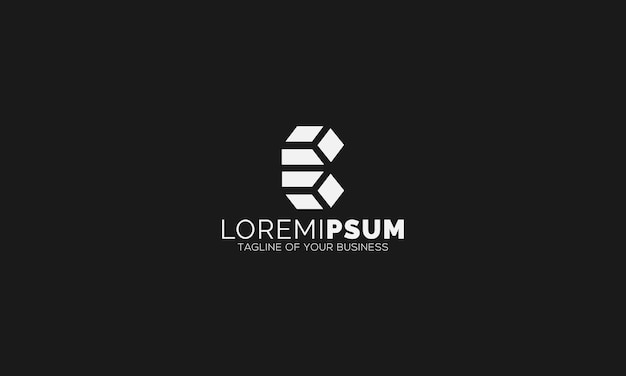
The height and width of the screenshot is (376, 626). Find the location of `corner`. corner is located at coordinates (19, 20), (17, 351), (593, 353), (597, 24).